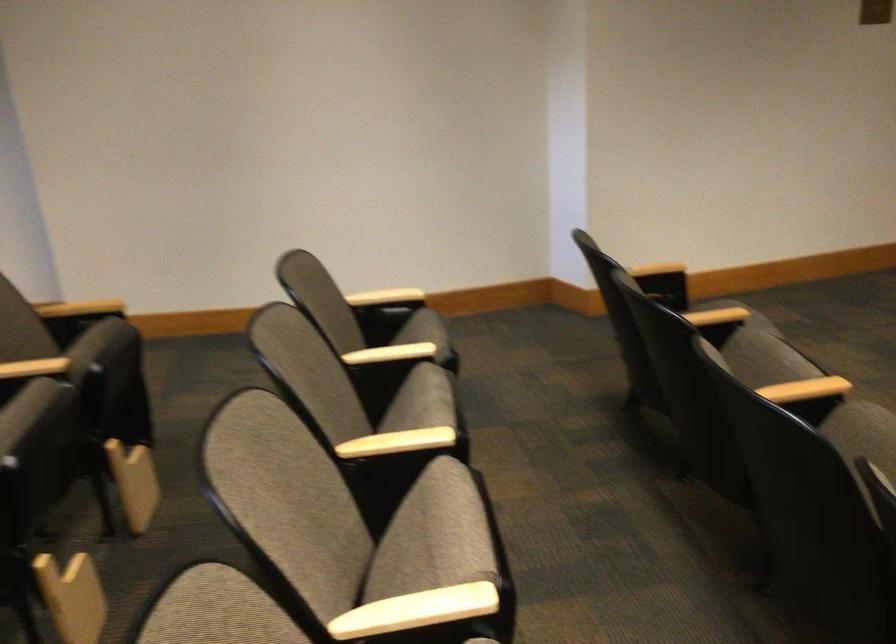
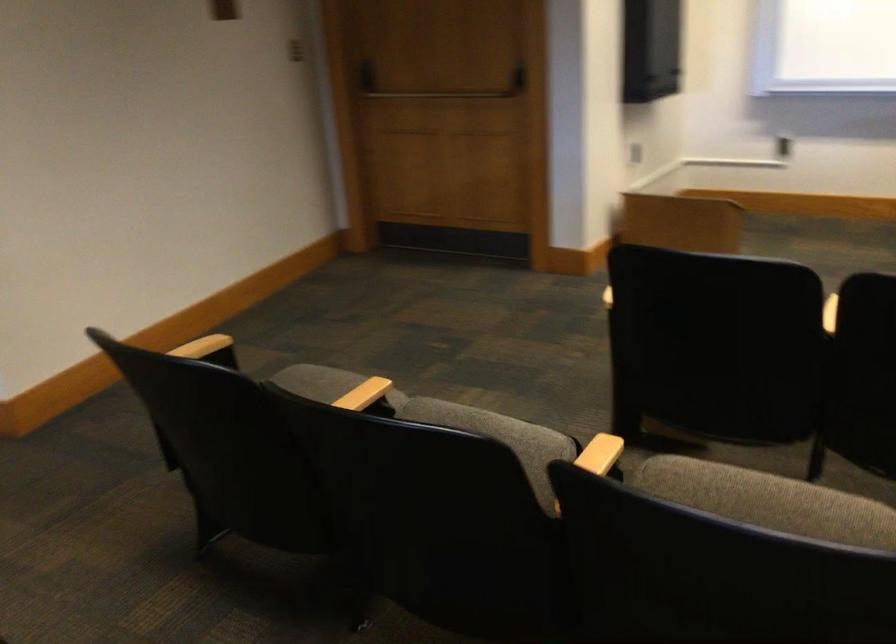
Where in the second image is the point corresponding to [820,383] from the first image?

(600, 455)